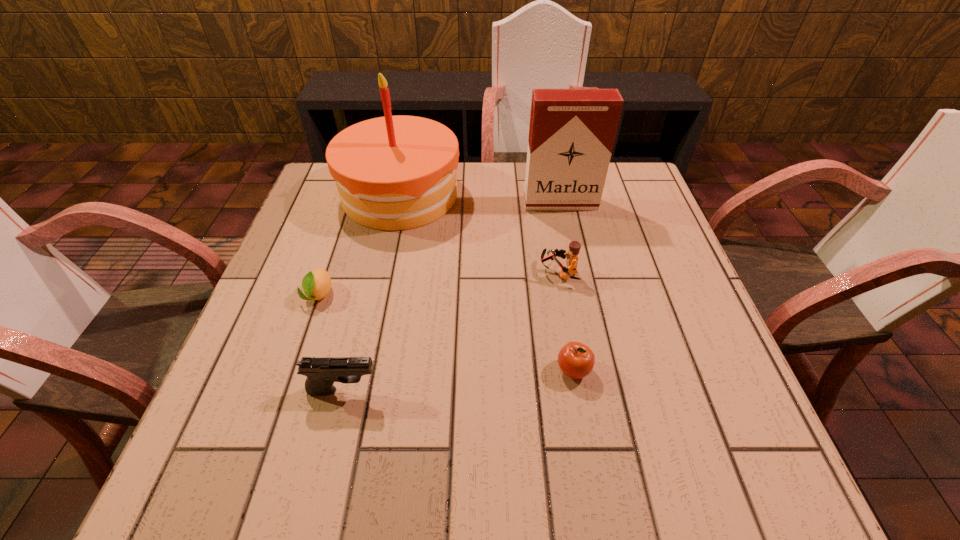
Locate an element on the screen. birthday cake is located at coordinates (392, 173).

Image resolution: width=960 pixels, height=540 pixels. In order to click on cigarette_case in this screenshot , I will do `click(572, 131)`.

Where is `pistol`? This screenshot has width=960, height=540. pistol is located at coordinates (321, 372).

You are a GUI agent. You are given a task and a screenshot of the screen. Output one action in this format:
    pyautogui.click(x=<x>, y=<y>)
    Task: Click on the Lego
    Image resolution: width=960 pixels, height=540 pixels.
    Given the screenshot: What is the action you would take?
    (574, 247)

Where is `the second shortest object`? the second shortest object is located at coordinates (576, 360).

I want to click on the shortest object, so click(x=316, y=284).

Identify the location of free space located on the right of the birthday cake. (544, 194).

Locate an element on the screen. The width and height of the screenshot is (960, 540). vacant space located on the front-facing side of the cigarette_case is located at coordinates point(570,249).

This screenshot has width=960, height=540. I want to click on free region located at the barrel of the pistol, so click(463, 390).

This screenshot has height=540, width=960. Identify the location of free spot located 0.170m holding a crossbow in the hands of the Lego. (465, 273).